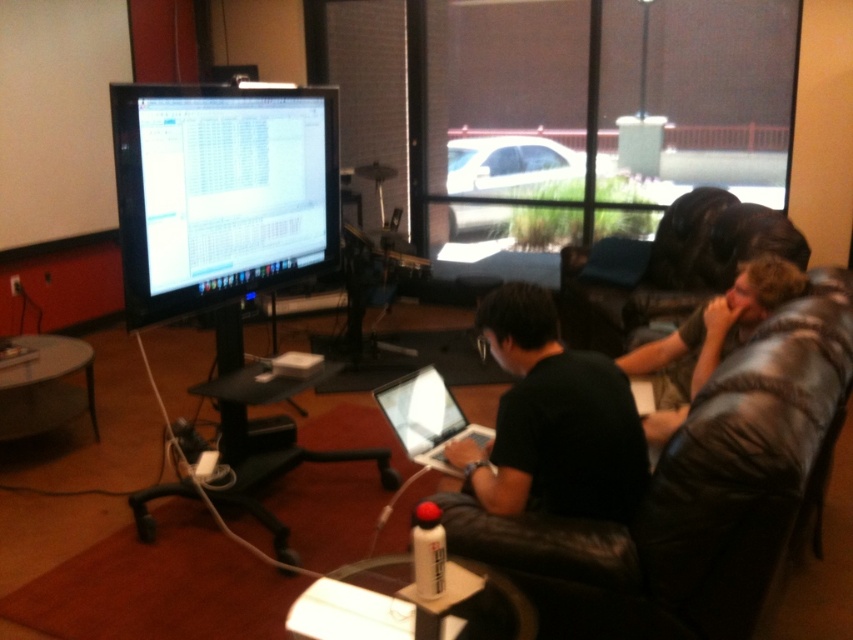
How much distance is there between black matte laptop at center and silver metallic laptop at center?

A distance of 11.00 inches exists between black matte laptop at center and silver metallic laptop at center.

Consider the image. Can you confirm if black matte laptop at center is positioned to the left of silver metallic laptop at center?

No, black matte laptop at center is not to the left of silver metallic laptop at center.

Describe the element at coordinates (550, 419) in the screenshot. I see `black matte laptop at center` at that location.

At what (x,y) coordinates should I click in order to perform the action: click on black matte laptop at center. Please return your answer as a coordinate pair (x, y). Looking at the image, I should click on (550, 419).

Does black matte laptop at center appear on the left side of dark brown leather couch at right?

Correct, you'll find black matte laptop at center to the left of dark brown leather couch at right.

Is point (556, 484) positioned behind point (721, 330)?

That is False.

Between point (468, 484) and point (755, 268), which one is positioned behind?

The point (755, 268) is behind.

This screenshot has width=853, height=640. I want to click on black matte laptop at center, so click(550, 419).

Is black leather couch at center wider than black matte laptop at center?

Indeed, black leather couch at center has a greater width compared to black matte laptop at center.

Is point (631, 618) farther from camera compared to point (590, 387)?

No, it is not.

What do you see at coordinates (697, 497) in the screenshot? Image resolution: width=853 pixels, height=640 pixels. I see `black leather couch at center` at bounding box center [697, 497].

In order to click on black leather couch at center in this screenshot , I will do `click(697, 497)`.